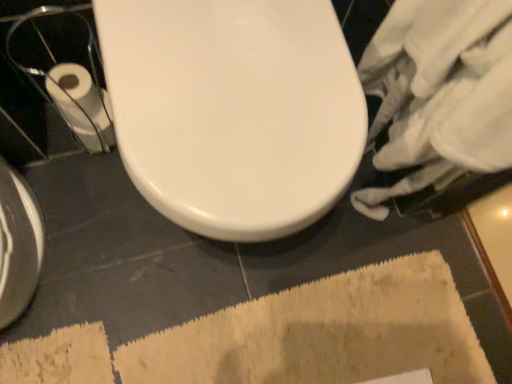
Question: Is beige textured bath mat at lower center at the back of white glossy toilet at center?

Choices:
 (A) no
 (B) yes

Answer: (A)

Question: From a real-world perspective, is white glossy toilet at center under beige textured bath mat at lower center?

Choices:
 (A) yes
 (B) no

Answer: (B)

Question: Is white glossy toilet at center closer to the viewer compared to beige textured bath mat at lower center?

Choices:
 (A) yes
 (B) no

Answer: (A)

Question: Can you confirm if white glossy toilet at center is bigger than beige textured bath mat at lower center?

Choices:
 (A) yes
 (B) no

Answer: (A)

Question: Is white glossy toilet at center outside of beige textured bath mat at lower center?

Choices:
 (A) yes
 (B) no

Answer: (A)

Question: Considering their positions, is white paper at left located in front of or behind white glossy toilet at center?

Choices:
 (A) front
 (B) behind

Answer: (B)

Question: Considering the relative positions of white paper at left and white glossy toilet at center in the image provided, is white paper at left to the left or to the right of white glossy toilet at center?

Choices:
 (A) left
 (B) right

Answer: (A)

Question: Considering the positions of white paper at left and white glossy toilet at center in the image, is white paper at left bigger or smaller than white glossy toilet at center?

Choices:
 (A) small
 (B) big

Answer: (A)

Question: From the image's perspective, relative to white glossy toilet at center, is white paper at left above or below?

Choices:
 (A) above
 (B) below

Answer: (A)

Question: From the image's perspective, is white glossy toilet at center above or below beige textured bath mat at lower center?

Choices:
 (A) above
 (B) below

Answer: (A)

Question: Is white glossy toilet at center inside the boundaries of beige textured bath mat at lower center, or outside?

Choices:
 (A) inside
 (B) outside

Answer: (B)

Question: Is white glossy toilet at center bigger or smaller than beige textured bath mat at lower center?

Choices:
 (A) small
 (B) big

Answer: (B)

Question: Is point (145, 132) positioned closer to the camera than point (297, 367)?

Choices:
 (A) closer
 (B) farther

Answer: (A)

Question: From a real-world perspective, relative to white glossy toilet at center, is beige textured bath mat at lower center vertically above or below?

Choices:
 (A) below
 (B) above

Answer: (A)

Question: Is beige textured bath mat at lower center bigger or smaller than white glossy toilet at center?

Choices:
 (A) small
 (B) big

Answer: (A)